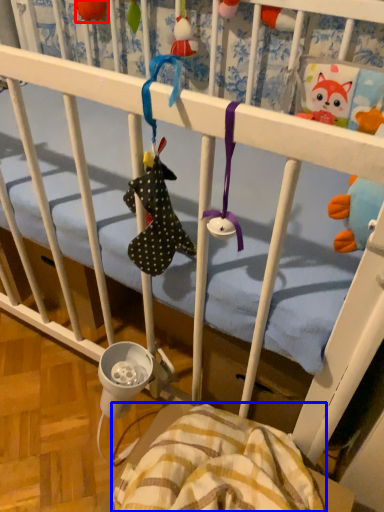
Question: Which object is further to the camera taking this photo, toy (highlighted by a red box) or blanket (highlighted by a blue box)?

Choices:
 (A) toy
 (B) blanket

Answer: (A)